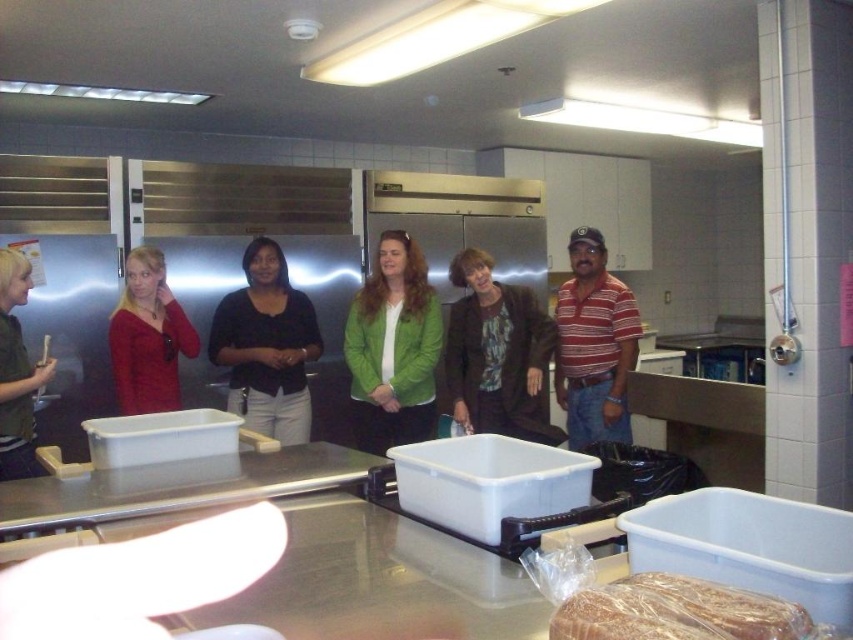
Question: Which object is closer to the camera taking this photo?

Choices:
 (A) green matte jacket at center
 (B) translucent plastic bread at lower right
 (C) matte red sweater at left

Answer: (B)

Question: Can you confirm if green matte jacket at center is wider than matte red sweater at left?

Choices:
 (A) yes
 (B) no

Answer: (A)

Question: Which is farther from the dark brown leather jacket at center?

Choices:
 (A) matte red sweater at left
 (B) matte green shirt at left

Answer: (B)

Question: Is green matte jacket at center positioned at the back of matte green shirt at left?

Choices:
 (A) yes
 (B) no

Answer: (A)

Question: Can you confirm if dark brown leather jacket at center is positioned below matte green shirt at left?

Choices:
 (A) no
 (B) yes

Answer: (A)

Question: Which of these objects is positioned closest to the matte red sweater at left?

Choices:
 (A) green matte jacket at center
 (B) translucent plastic bread at lower right

Answer: (A)